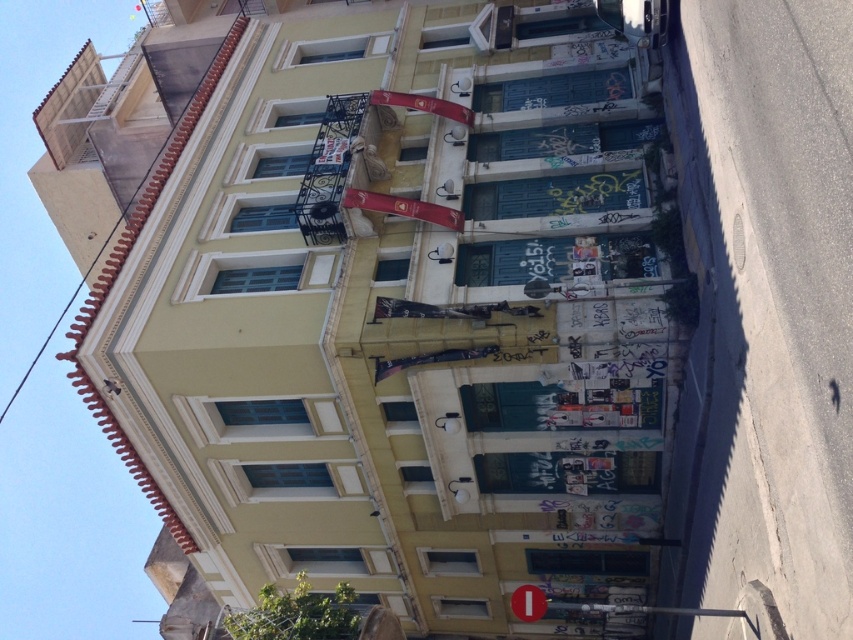
Question: Is asphalt at lower right below red fabric flag at upper center?

Choices:
 (A) yes
 (B) no

Answer: (A)

Question: Estimate the real-world distances between objects in this image. Which object is farther from the red matte sign at lower center?

Choices:
 (A) red fabric flag at upper center
 (B) metallic banner at center

Answer: (A)

Question: Which of the following is the farthest from the observer?

Choices:
 (A) click(x=514, y=595)
 (B) click(x=447, y=218)
 (C) click(x=764, y=541)

Answer: (A)

Question: Is asphalt at lower right positioned before red matte sign at lower center?

Choices:
 (A) no
 (B) yes

Answer: (B)

Question: Which of these objects is positioned closest to the metallic banner at center?

Choices:
 (A) red fabric flag at upper center
 (B) red matte sign at lower center

Answer: (A)

Question: Is red fabric flag at upper center bigger than red matte sign at lower center?

Choices:
 (A) yes
 (B) no

Answer: (B)